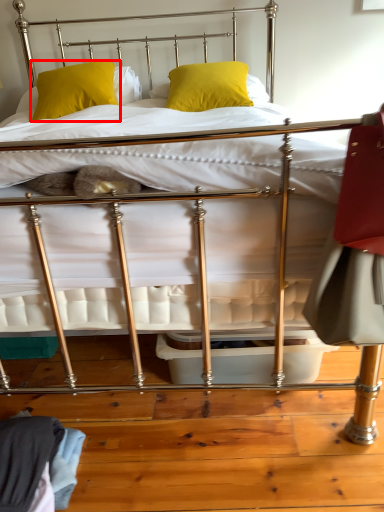
Question: Considering the relative positions of pillow (annotated by the red box) and pillow in the image provided, where is pillow (annotated by the red box) located with respect to the staircase?

Choices:
 (A) left
 (B) right

Answer: (A)